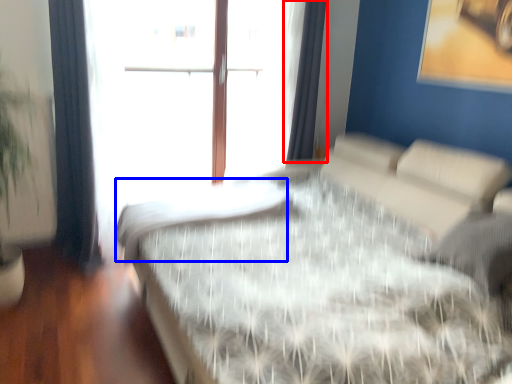
Question: Which of the following is the farthest to the observer, curtain (highlighted by a red box) or mattress (highlighted by a blue box)?

Choices:
 (A) curtain
 (B) mattress

Answer: (A)